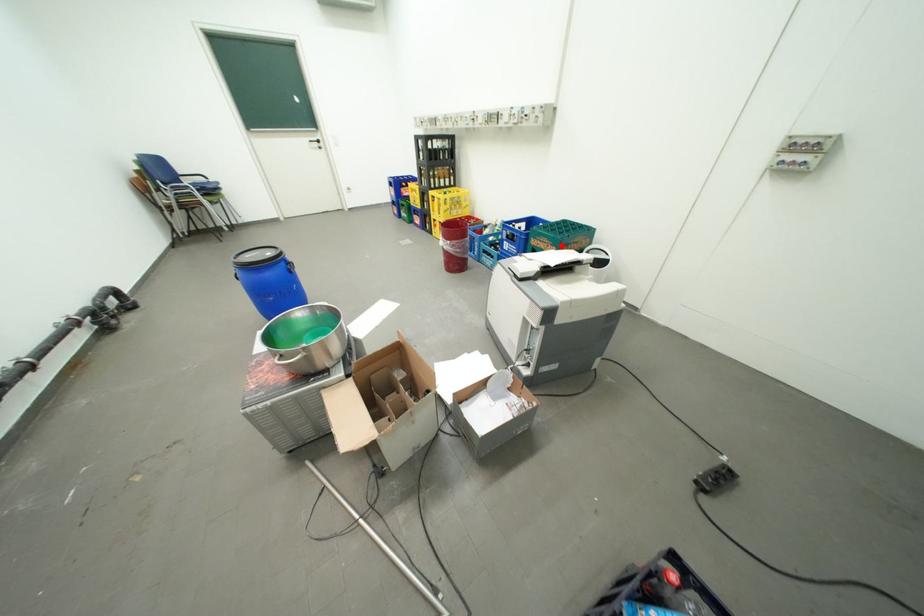
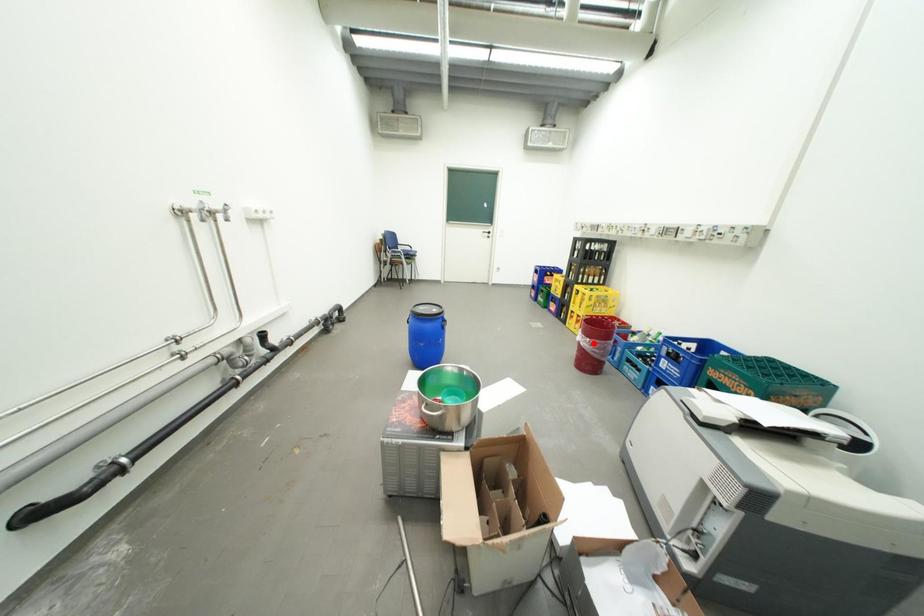
I am providing you with two images of the same scene from different viewpoints. A red point is marked on the first image and another point is marked on the second image. Do the highlighted points in image1 and image2 indicate the same real-world spot?

No